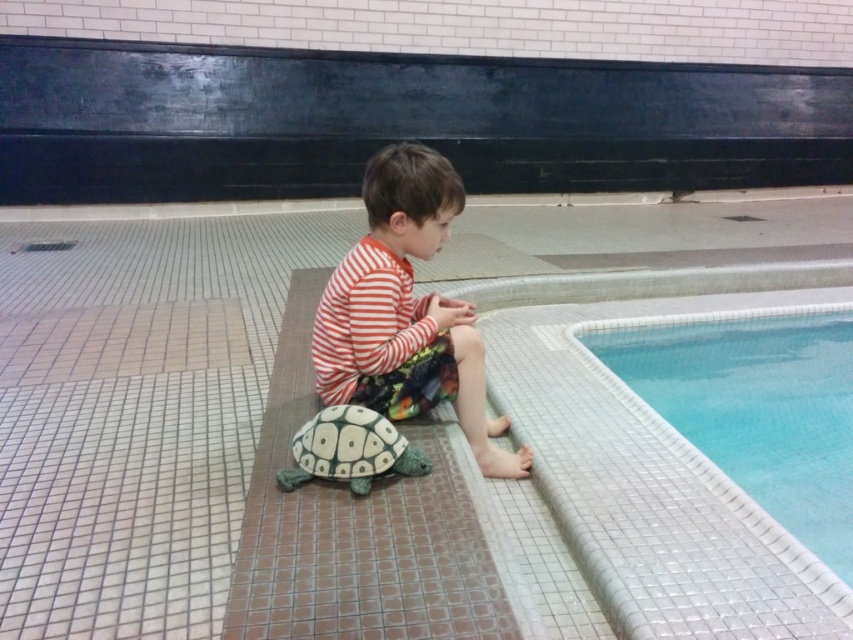
Question: Observing the image, what is the correct spatial positioning of white mosaic tile at upper right in reference to striped fabric child at center?

Choices:
 (A) below
 (B) above

Answer: (A)

Question: Which of the following is the closest to the observer?

Choices:
 (A) white mosaic tile at upper right
 (B) striped fabric child at center

Answer: (B)

Question: Does white mosaic tile at upper right have a greater width compared to striped fabric child at center?

Choices:
 (A) no
 (B) yes

Answer: (B)

Question: Where is white mosaic tile at upper right located in relation to striped fabric child at center in the image?

Choices:
 (A) right
 (B) left

Answer: (A)

Question: Which of the following is the closest to the observer?

Choices:
 (A) (838, 381)
 (B) (381, 230)

Answer: (B)

Question: Among these objects, which one is farthest from the camera?

Choices:
 (A) striped fabric child at center
 (B) white mosaic tile at upper right

Answer: (B)